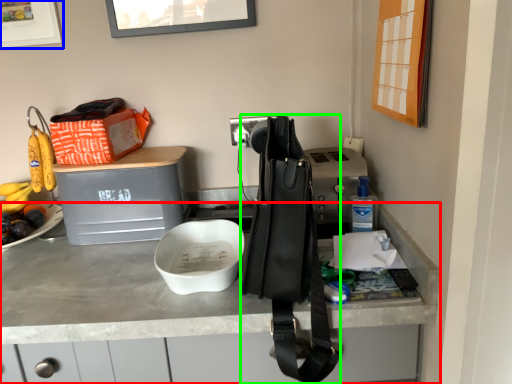
Question: Considering the real-world distances, which object is closest to desk (highlighted by a red box)? picture frame (highlighted by a blue box) or handbag (highlighted by a green box).

Choices:
 (A) picture frame
 (B) handbag

Answer: (B)